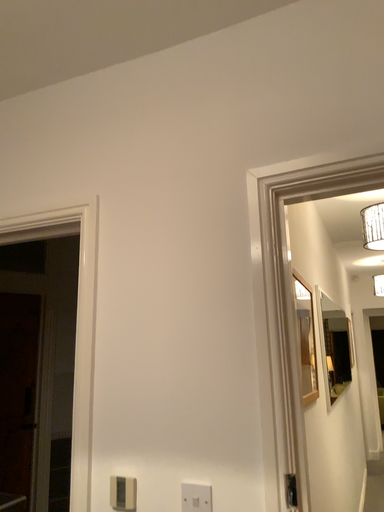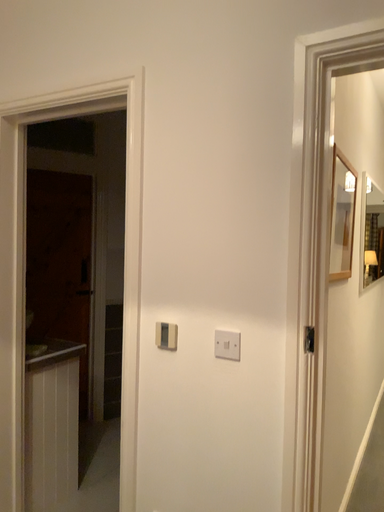
Question: How did the camera likely rotate when shooting the video?

Choices:
 (A) rotated right
 (B) rotated left

Answer: (B)